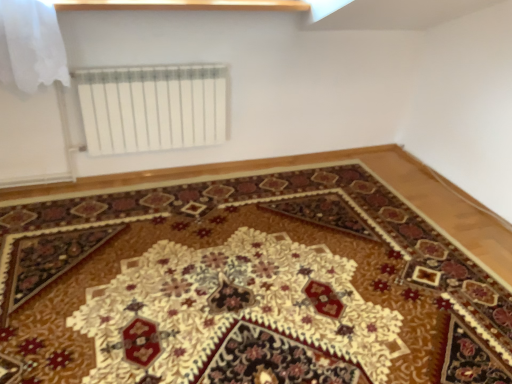
Question: Should I look upward or downward to see wooden at upper center?

Choices:
 (A) down
 (B) up

Answer: (B)